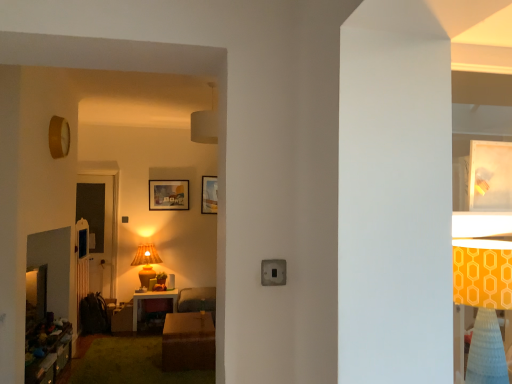
Where is `vacant space in front of brown wooden table at center, the 1th table in the right-to-left sequence`? The height and width of the screenshot is (384, 512). vacant space in front of brown wooden table at center, the 1th table in the right-to-left sequence is located at coordinates (164, 374).